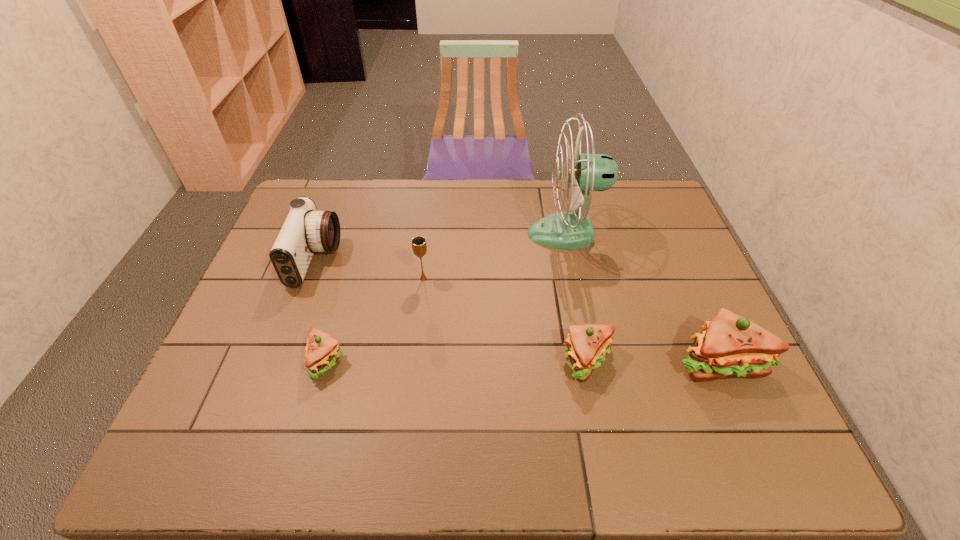
Locate an element on the screen. The height and width of the screenshot is (540, 960). spot to insert another sandwich for uniform distribution is located at coordinates (457, 361).